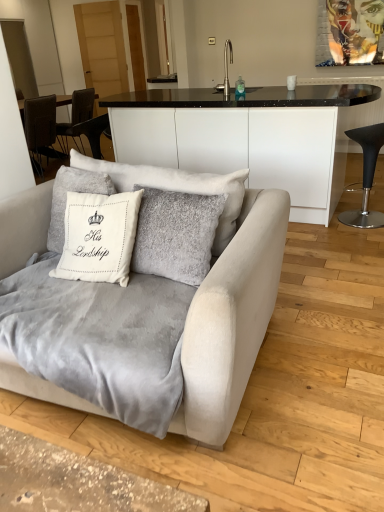
Question: Can you confirm if white soft cushion at center is smaller than metallic faucet at upper center?

Choices:
 (A) no
 (B) yes

Answer: (A)

Question: Does white soft cushion at center come behind metallic faucet at upper center?

Choices:
 (A) no
 (B) yes

Answer: (A)

Question: From a real-world perspective, does white soft cushion at center stand above metallic faucet at upper center?

Choices:
 (A) no
 (B) yes

Answer: (A)

Question: Is white soft cushion at center closer to the viewer compared to metallic faucet at upper center?

Choices:
 (A) no
 (B) yes

Answer: (B)

Question: Does white soft cushion at center have a greater width compared to metallic faucet at upper center?

Choices:
 (A) no
 (B) yes

Answer: (A)

Question: Does white soft cushion at center touch metallic faucet at upper center?

Choices:
 (A) yes
 (B) no

Answer: (B)

Question: Is black leather stool at right to the left of metallic faucet at upper center from the viewer's perspective?

Choices:
 (A) no
 (B) yes

Answer: (A)

Question: Is metallic faucet at upper center at the back of black leather stool at right?

Choices:
 (A) yes
 (B) no

Answer: (B)

Question: Can you confirm if black leather stool at right is thinner than metallic faucet at upper center?

Choices:
 (A) yes
 (B) no

Answer: (B)

Question: Can you confirm if black leather stool at right is bigger than metallic faucet at upper center?

Choices:
 (A) no
 (B) yes

Answer: (B)

Question: Can you confirm if black leather stool at right is shorter than metallic faucet at upper center?

Choices:
 (A) yes
 (B) no

Answer: (B)

Question: Is black leather stool at right oriented towards metallic faucet at upper center?

Choices:
 (A) yes
 (B) no

Answer: (B)

Question: Does suede gray couch at lower left come behind white soft cushion at center?

Choices:
 (A) no
 (B) yes

Answer: (A)